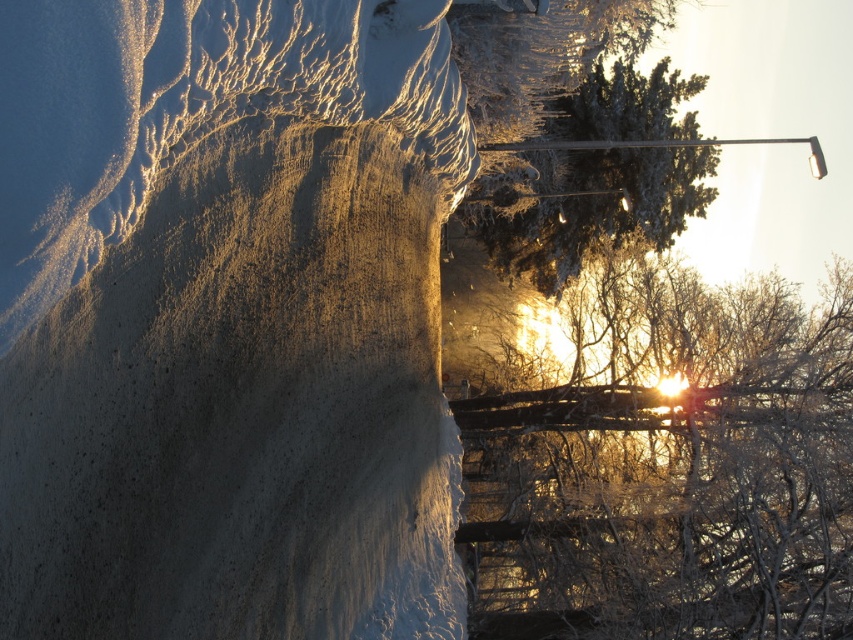
Does point (430, 145) come behind point (527, 465)?

No, it is not.

Is smooth concrete cliff at center further to the viewer compared to frosty white branches at upper right?

No.

Locate an element on the screen. Image resolution: width=853 pixels, height=640 pixels. smooth concrete cliff at center is located at coordinates (225, 317).